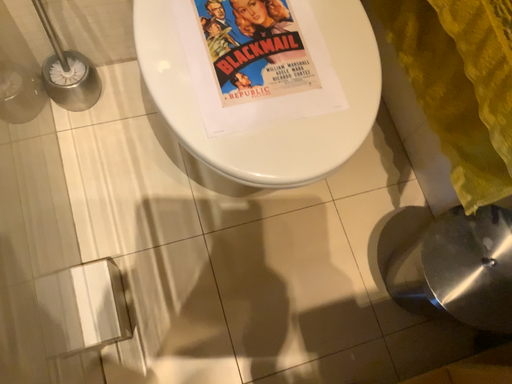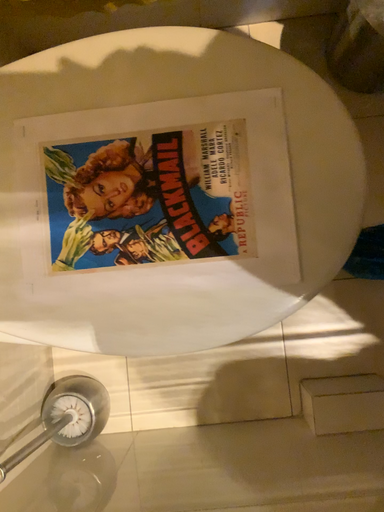
Question: How did the camera likely rotate when shooting the video?

Choices:
 (A) rotated right
 (B) rotated left

Answer: (A)